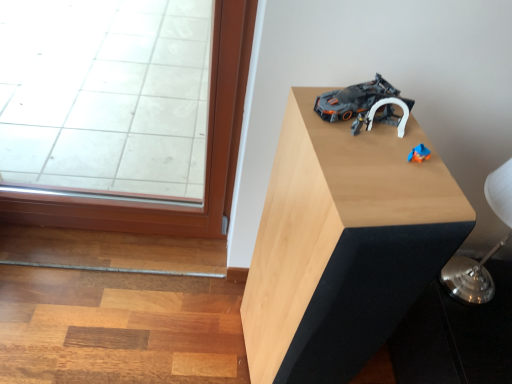
Question: Considering the relative positions of silver metallic table lamp at upper right and light wood table at upper right in the image provided, is silver metallic table lamp at upper right to the left or to the right of light wood table at upper right?

Choices:
 (A) left
 (B) right

Answer: (B)

Question: From a real-world perspective, is silver metallic table lamp at upper right above or below light wood table at upper right?

Choices:
 (A) below
 (B) above

Answer: (B)

Question: Estimate the real-world distances between objects in this image. Which object is farther from the light wood table at upper right?

Choices:
 (A) silver metallic table lamp at upper right
 (B) dark gray plastic toy car at upper right

Answer: (A)

Question: Based on their relative distances, which object is farther from the dark gray plastic toy car at upper right?

Choices:
 (A) light wood table at upper right
 (B) silver metallic table lamp at upper right

Answer: (B)